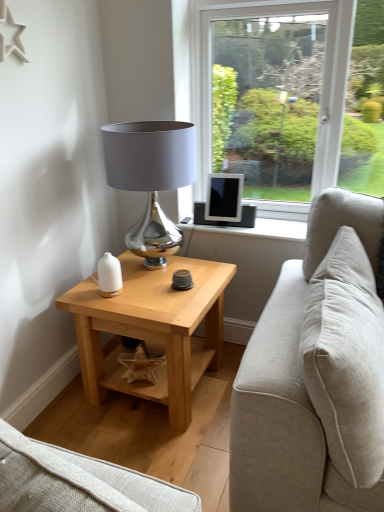
Locate an element on the screen. This screenshot has width=384, height=512. shiny metallic lampshade at center is located at coordinates (151, 178).

The width and height of the screenshot is (384, 512). What do you see at coordinates (151, 178) in the screenshot? I see `shiny metallic lampshade at center` at bounding box center [151, 178].

Describe the element at coordinates (346, 359) in the screenshot. I see `beige fabric pillow at right` at that location.

Where is `matte black tablet at upper right`? matte black tablet at upper right is located at coordinates (224, 197).

Find the location of a particular element. The width and height of the screenshot is (384, 512). shiny metallic lampshade at center is located at coordinates pyautogui.click(x=151, y=178).

Looking at the image, does matte black tablet at upper right seem bigger or smaller compared to shiny metallic lampshade at center?

matte black tablet at upper right is smaller than shiny metallic lampshade at center.

From a real-world perspective, is matte black tablet at upper right physically located above or below shiny metallic lampshade at center?

Clearly, from a real-world perspective, matte black tablet at upper right is below shiny metallic lampshade at center.

From the image's perspective, is matte black tablet at upper right positioned above or below shiny metallic lampshade at center?

Based on their image positions, matte black tablet at upper right is located above shiny metallic lampshade at center.

Considering the sizes of objects matte black tablet at upper right and shiny metallic lampshade at center in the image provided, who is taller, matte black tablet at upper right or shiny metallic lampshade at center?

shiny metallic lampshade at center is taller.

Which is behind, shiny metallic lampshade at center or matte black tablet at upper right?

matte black tablet at upper right is further away from the camera.

Which of these two, shiny metallic lampshade at center or matte black tablet at upper right, stands taller?

shiny metallic lampshade at center.

Who is smaller, shiny metallic lampshade at center or matte black tablet at upper right?

Smaller between the two is matte black tablet at upper right.

Is beige fabric pillow at right to the right of light wood/texture side table at lower left from the viewer's perspective?

Correct, you'll find beige fabric pillow at right to the right of light wood/texture side table at lower left.

Is beige fabric pillow at right in contact with light wood/texture side table at lower left?

No, beige fabric pillow at right is not next to light wood/texture side table at lower left.

Considering the sizes of objects matte black tablet at upper right and beige fabric pillow at right in the image provided, who is wider, matte black tablet at upper right or beige fabric pillow at right?

With larger width is beige fabric pillow at right.

Considering the points (238, 191) and (373, 366), which point is behind, point (238, 191) or point (373, 366)?

The point (238, 191) is farther from the camera.

Who is more distant, matte black tablet at upper right or beige fabric pillow at right?

matte black tablet at upper right.

Is matte black tablet at upper right not within beige fabric pillow at right?

Yes.

From a real-world perspective, is light wood/texture side table at lower left above or below matte black tablet at upper right?

light wood/texture side table at lower left is below matte black tablet at upper right.

Considering the relative sizes of light wood/texture side table at lower left and matte black tablet at upper right in the image provided, is light wood/texture side table at lower left smaller than matte black tablet at upper right?

Incorrect, light wood/texture side table at lower left is not smaller in size than matte black tablet at upper right.

Is light wood/texture side table at lower left positioned with its back to matte black tablet at upper right?

No, light wood/texture side table at lower left's orientation is not away from matte black tablet at upper right.

Is light wood/texture side table at lower left in front of matte black tablet at upper right?

Yes.

Is matte black tablet at upper right positioned beyond the bounds of light wood/texture side table at lower left?

That's correct, matte black tablet at upper right is outside of light wood/texture side table at lower left.

Does matte black tablet at upper right have a lesser width compared to light wood/texture side table at lower left?

Yes.

Which point is more forward, (217, 180) or (133, 327)?

Point (133, 327)

Does beige fabric pillow at right appear on the left side of shiny metallic lampshade at center?

No.

In the scene shown: Is beige fabric pillow at right oriented away from shiny metallic lampshade at center?

Correct, beige fabric pillow at right is looking away from shiny metallic lampshade at center.

Locate an element on the screen. pillow lying in front of the shiny metallic lampshade at center is located at coordinates (346, 359).

The height and width of the screenshot is (512, 384). What are the coordinates of `computer monitor above the shiny metallic lampshade at center (from the image's perspective)` in the screenshot? It's located at (224, 197).

Identify the location of table lamp below the matte black tablet at upper right (from the image's perspective). (151, 178).

When comparing their distances from matte black tablet at upper right, does shiny metallic lampshade at center or light wood/texture side table at lower left seem closer?

shiny metallic lampshade at center.

From the image, which object appears to be nearer to shiny metallic lampshade at center, beige fabric pillow at right or matte black tablet at upper right?

matte black tablet at upper right lies closer to shiny metallic lampshade at center than the other object.

Considering their positions, is matte black tablet at upper right positioned closer to shiny metallic lampshade at center than beige fabric pillow at right?

Based on the image, matte black tablet at upper right appears to be nearer to shiny metallic lampshade at center.

Based on their spatial positions, is matte black tablet at upper right or light wood/texture side table at lower left further from shiny metallic lampshade at center?

The object further to shiny metallic lampshade at center is light wood/texture side table at lower left.

Which object lies further to the anchor point matte black tablet at upper right, light wood/texture side table at lower left or beige fabric pillow at right?

Among the two, beige fabric pillow at right is located further to matte black tablet at upper right.

From the picture: Which object lies nearer to the anchor point light wood/texture side table at lower left, shiny metallic lampshade at center or beige fabric pillow at right?

The object closer to light wood/texture side table at lower left is shiny metallic lampshade at center.

Looking at the image, which one is located closer to light wood/texture side table at lower left, shiny metallic lampshade at center or matte black tablet at upper right?

Based on the image, shiny metallic lampshade at center appears to be nearer to light wood/texture side table at lower left.

Considering their positions, is light wood/texture side table at lower left positioned closer to beige fabric pillow at right than matte black tablet at upper right?

light wood/texture side table at lower left.

Identify the location of table between beige fabric pillow at right and shiny metallic lampshade at center from front to back. This screenshot has width=384, height=512. (152, 329).

Where is `table lamp between beige fabric pillow at right and matte black tablet at upper right in the front-back direction`? This screenshot has width=384, height=512. table lamp between beige fabric pillow at right and matte black tablet at upper right in the front-back direction is located at coordinates (151, 178).

Where is `table lamp that lies between matte black tablet at upper right and light wood/texture side table at lower left from top to bottom`? Image resolution: width=384 pixels, height=512 pixels. table lamp that lies between matte black tablet at upper right and light wood/texture side table at lower left from top to bottom is located at coordinates (151, 178).

Identify the location of table positioned between beige fabric pillow at right and matte black tablet at upper right from near to far. This screenshot has height=512, width=384. (152, 329).